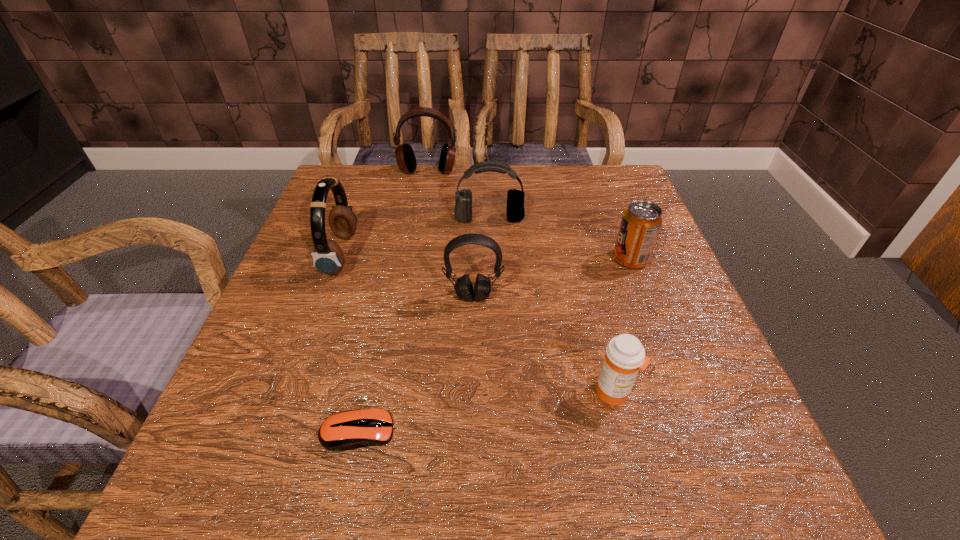
Find the location of a particular element. The height and width of the screenshot is (540, 960). vacant region at the near right corner of the desktop is located at coordinates (746, 447).

The width and height of the screenshot is (960, 540). I want to click on vacant region between the sixth nearest object and the nearest headset, so click(482, 258).

Find the location of a particular element. Image resolution: width=960 pixels, height=540 pixels. free space between the leftmost headset and the computer mouse is located at coordinates (349, 343).

Where is `empty space between the farthest headset and the medicine`? The height and width of the screenshot is (540, 960). empty space between the farthest headset and the medicine is located at coordinates (521, 282).

You are a GUI agent. You are given a task and a screenshot of the screen. Output one action in this format:
    pyautogui.click(x=<x>, y=<y>)
    Task: Click on the vacant space in between the sixth object from left to right and the soda can
    The height and width of the screenshot is (540, 960).
    Given the screenshot: What is the action you would take?
    pyautogui.click(x=622, y=326)

This screenshot has width=960, height=540. I want to click on free space between the medicine and the leftmost headset, so click(477, 323).

This screenshot has height=540, width=960. In order to click on free space between the medicine and the shortest object in this screenshot , I will do [486, 412].

Identify the location of free space between the third nearest object and the sixth nearest object. (482, 258).

Image resolution: width=960 pixels, height=540 pixels. What are the coordinates of `free space between the leftmost headset and the sixth farthest object` in the screenshot? It's located at (477, 323).

Locate an element on the screen. This screenshot has width=960, height=540. free space between the second nearest headset and the third nearest headset is located at coordinates (415, 237).